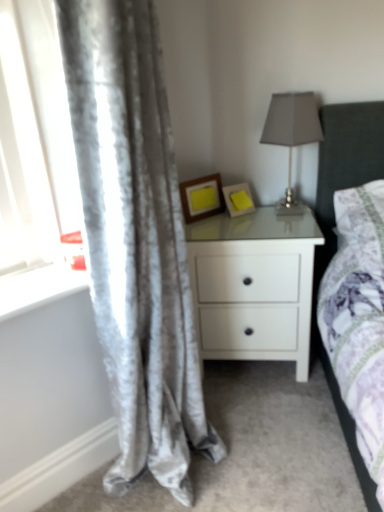
The height and width of the screenshot is (512, 384). What are the coordinates of `vacant area that is in front of satin gray lampshade at upper right` in the screenshot? It's located at (287, 232).